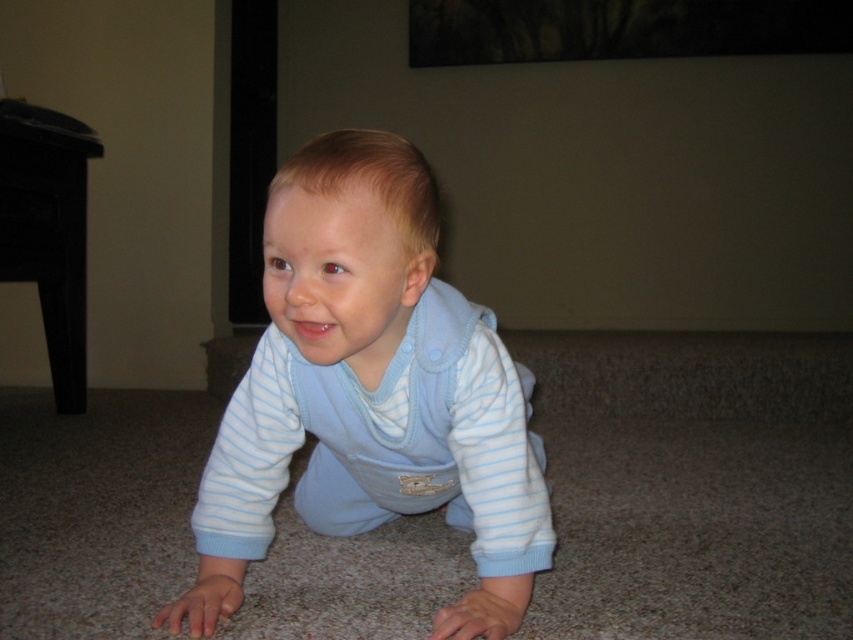
Based on the scene description, where is the light blue soft fabric baby at center located in terms of coordinates?

The light blue soft fabric baby at center is located at coordinates point (369, 390).

You are a photographer setting up for a portrait. You want to capture the light blue soft fabric baby at center in focus while blurring the background. What distance should you maintain from the baby to ensure it is in sharp focus?

To ensure the light blue soft fabric baby at center is in sharp focus while blurring the background, you should position yourself approximately 33.57 inches away from the baby.

The child is crawling towards a toy located at one of the two points. The toy is either at point (437, 324) or point (10, 282). Based on their position, which point is closer to the child?

Point (437, 324) is in front of point (10, 282), so the toy at point (437, 324) is closer to the child.